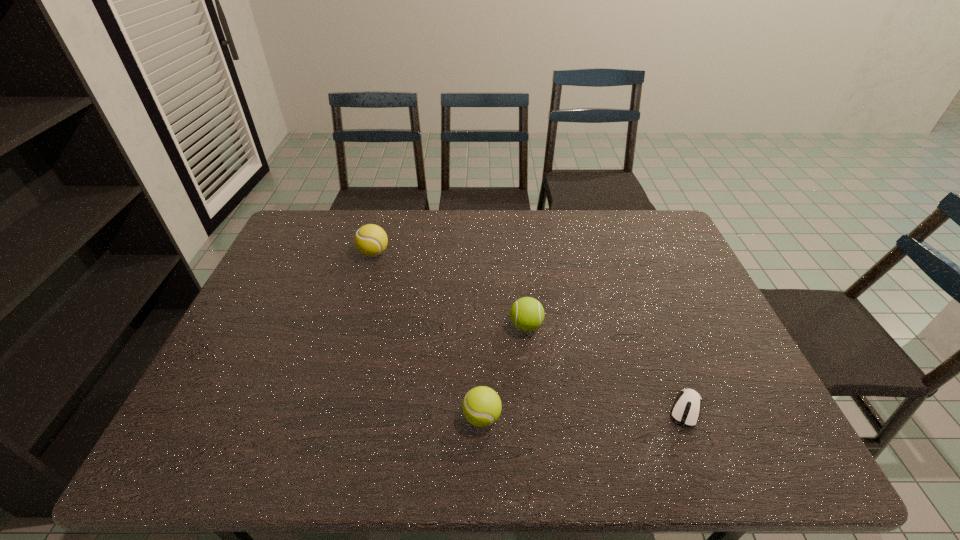
Find the location of a particular element. This screenshot has width=960, height=540. the leftmost tennis ball is located at coordinates (371, 240).

The height and width of the screenshot is (540, 960). What are the coordinates of `the farthest object` in the screenshot? It's located at (371, 240).

The width and height of the screenshot is (960, 540). Identify the location of the third object from left to right. (527, 314).

The width and height of the screenshot is (960, 540). What are the coordinates of `the rightmost tennis ball` in the screenshot? It's located at (527, 314).

The width and height of the screenshot is (960, 540). I want to click on the nearest tennis ball, so click(481, 406).

Where is `the second tennis ball from right to left`? The image size is (960, 540). the second tennis ball from right to left is located at coordinates (481, 406).

In order to click on the rightmost object in this screenshot , I will do `click(686, 409)`.

Where is `the shortest object`? the shortest object is located at coordinates (686, 409).

Locate an element on the screen. Image resolution: width=960 pixels, height=540 pixels. vacant region located 0.260m on the front of the leftmost tennis ball is located at coordinates (353, 325).

Identify the location of free point located on the back of the second object from right to left. (516, 234).